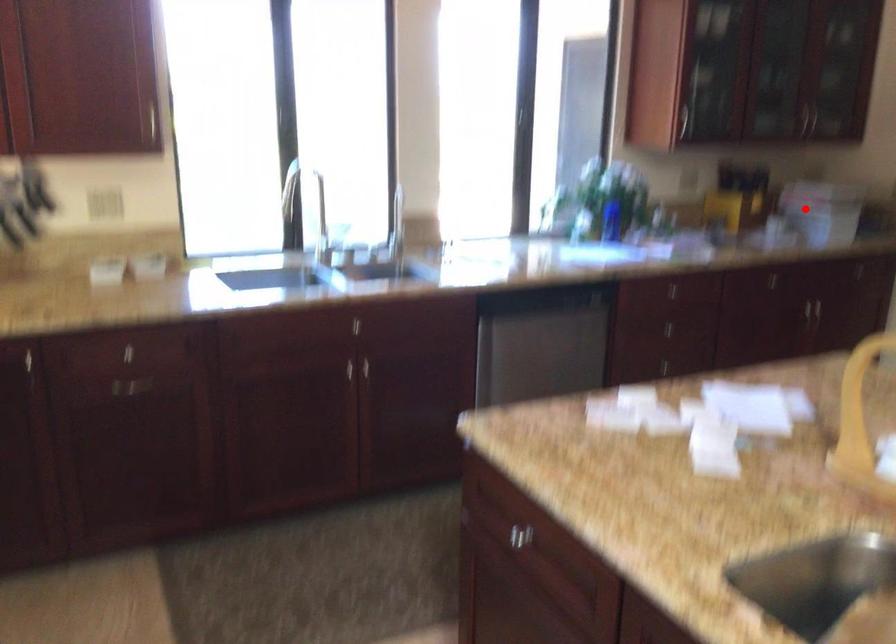
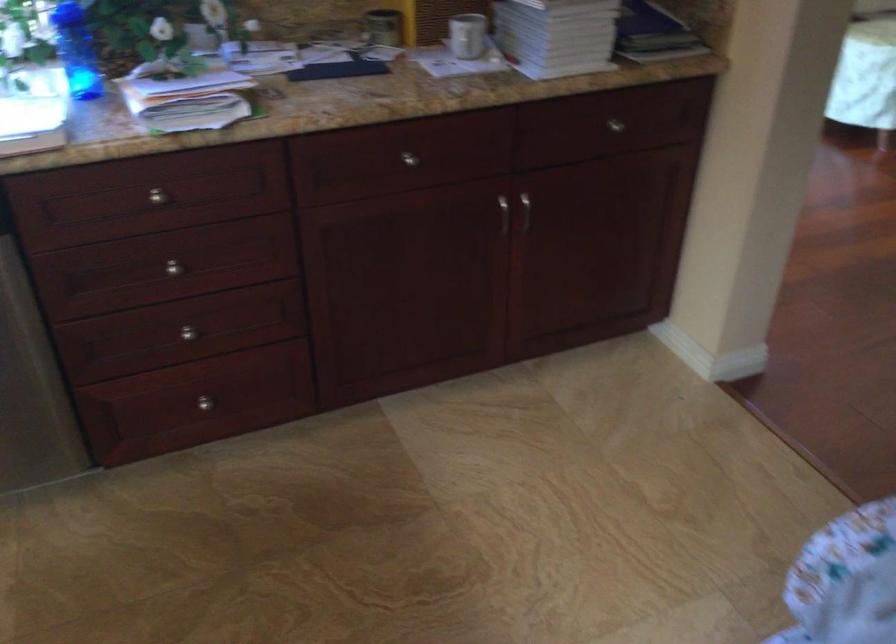
Question: I am providing you with two images of the same scene from different viewpoints. Image1 has a red point marked. In image2, the corresponding 3D location appears at what relative position? Reply with the corresponding letter.

Choices:
 (A) Closer
 (B) Farther

Answer: (A)